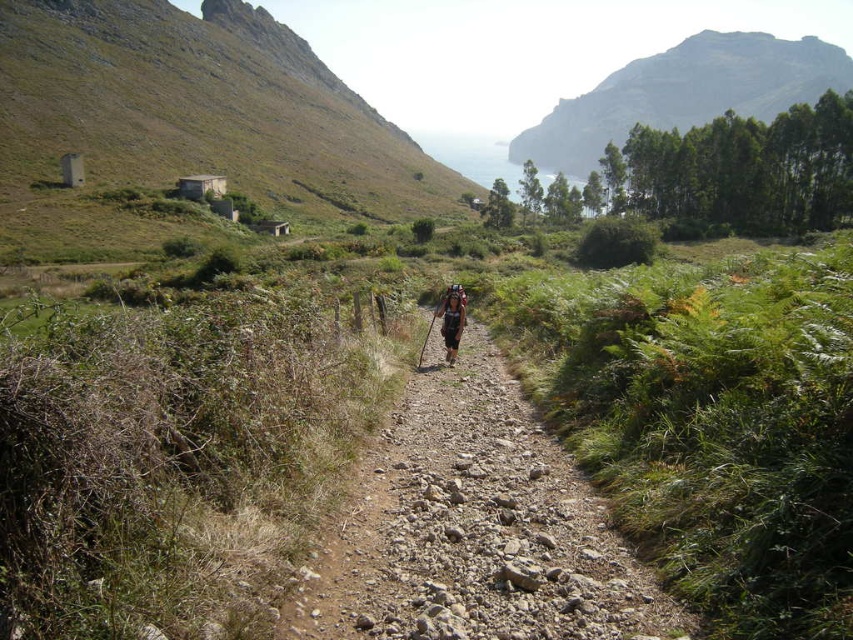
Question: Which of the following is the closest to the observer?

Choices:
 (A) (448, 298)
 (B) (397, 435)
 (C) (583, 140)

Answer: (B)

Question: Does dusty gravel trail at center come in front of dark brown leather backpack at center?

Choices:
 (A) yes
 (B) no

Answer: (A)

Question: Is the position of dusty gravel trail at center less distant than that of green rocky mountain at upper center?

Choices:
 (A) yes
 (B) no

Answer: (A)

Question: Estimate the real-world distances between objects in this image. Which object is farther from the green rocky mountain at upper center?

Choices:
 (A) dark brown leather backpack at center
 (B) dusty gravel trail at center

Answer: (A)

Question: Does dusty gravel trail at center have a larger size compared to dark brown leather backpack at center?

Choices:
 (A) no
 (B) yes

Answer: (B)

Question: Considering the real-world distances, which object is farthest from the green rocky mountain at upper center?

Choices:
 (A) dark brown leather backpack at center
 (B) dusty gravel trail at center

Answer: (A)